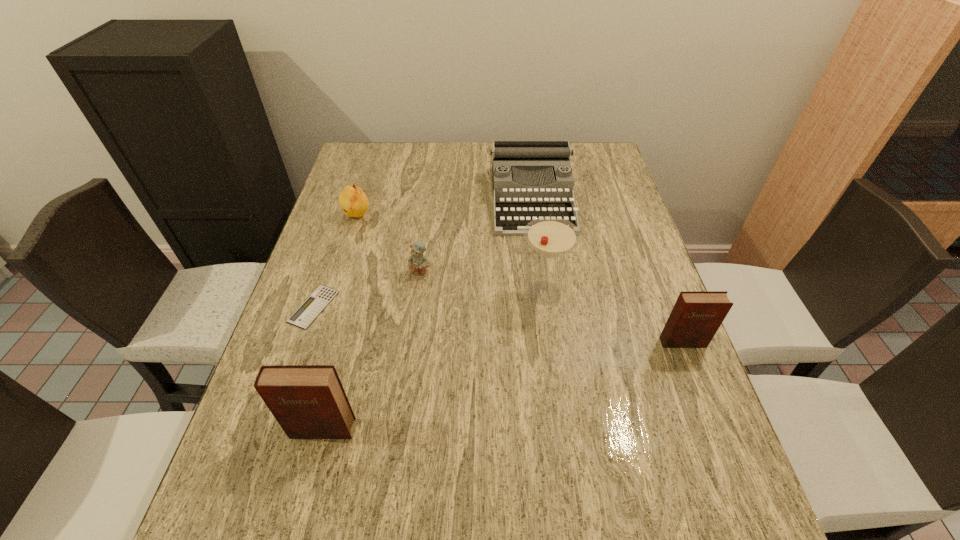
Where is `typewriter that is positioned at the right edge`? Image resolution: width=960 pixels, height=540 pixels. typewriter that is positioned at the right edge is located at coordinates (524, 157).

Find the location of a particular element. object that is at the near left corner is located at coordinates (308, 401).

Find the location of `object positioned at the far right corner`. object positioned at the far right corner is located at coordinates (524, 157).

The image size is (960, 540). I want to click on vacant space at the far edge of the desktop, so click(x=448, y=163).

The width and height of the screenshot is (960, 540). In the image, there is a desktop. What are the coordinates of `free region at the left edge` in the screenshot? It's located at (335, 198).

You are a GUI agent. You are given a task and a screenshot of the screen. Output one action in this format:
    pyautogui.click(x=<x>, y=<y>)
    Task: Click on the free space at the right edge of the desktop
    
    Given the screenshot: What is the action you would take?
    pyautogui.click(x=592, y=200)

The height and width of the screenshot is (540, 960). I want to click on vacant area at the near right corner, so click(x=673, y=437).

Where is `free area in between the pear and the fourth object from right to left`? The height and width of the screenshot is (540, 960). free area in between the pear and the fourth object from right to left is located at coordinates (389, 244).

The width and height of the screenshot is (960, 540). I want to click on free spot between the teddy bear and the martini, so tap(482, 283).

Identify the location of free space between the martini and the teddy bear. Image resolution: width=960 pixels, height=540 pixels. (482, 283).